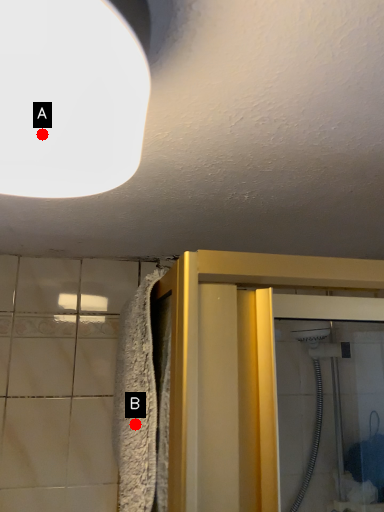
Question: Two points are circled on the image, labeled by A and B beside each circle. Which of the following is the farthest from the observer?

Choices:
 (A) A is further
 (B) B is further

Answer: (B)